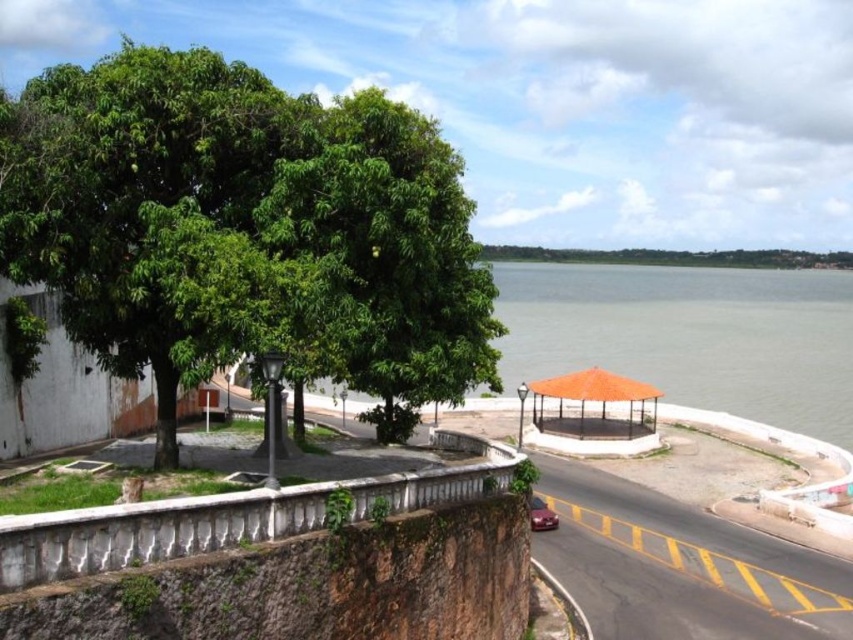
Question: Is green leafy tree at upper left wider than shiny red car at lower center?

Choices:
 (A) yes
 (B) no

Answer: (A)

Question: Which of the following is the closest to the observer?

Choices:
 (A) shiny red car at lower center
 (B) green leafy tree at upper left

Answer: (B)

Question: Can you confirm if green leafy tree at upper left is positioned below shiny red car at lower center?

Choices:
 (A) no
 (B) yes

Answer: (A)

Question: Which object is closer to the camera taking this photo?

Choices:
 (A) green leafy tree at upper left
 (B) shiny red car at lower center

Answer: (A)

Question: Is green leafy tree at upper left to the right of shiny red car at lower center from the viewer's perspective?

Choices:
 (A) no
 (B) yes

Answer: (A)